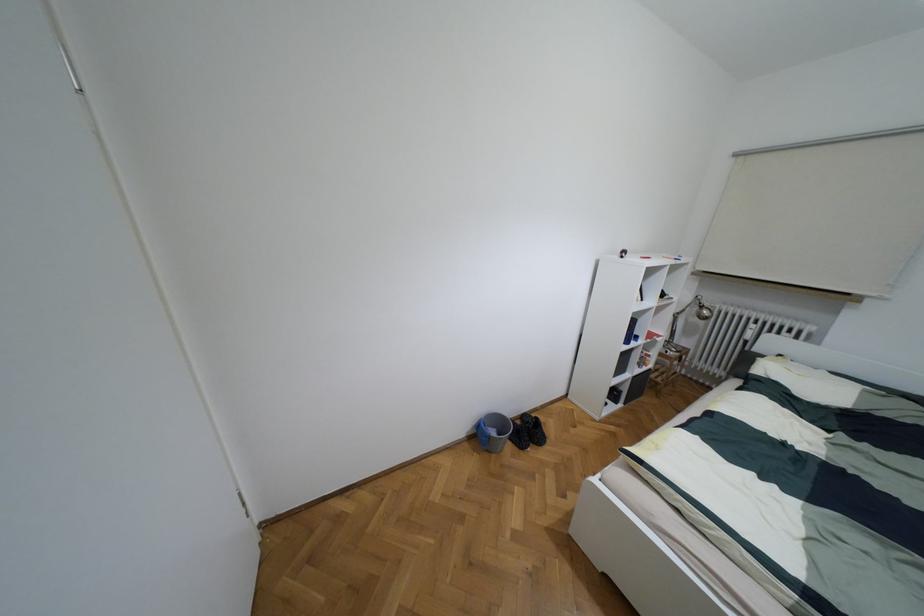
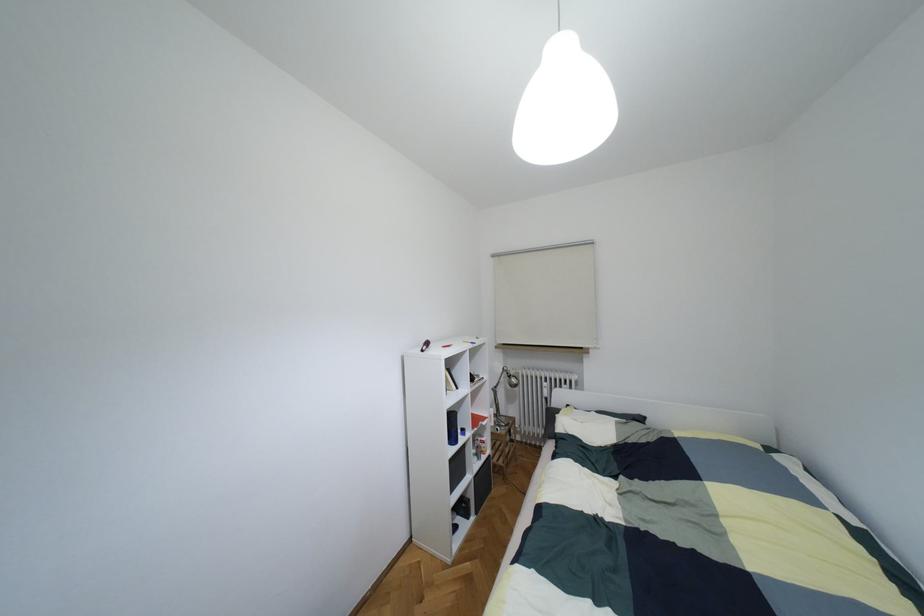
Find the pixel in the second image that matches (699,306) in the first image.

(508, 376)